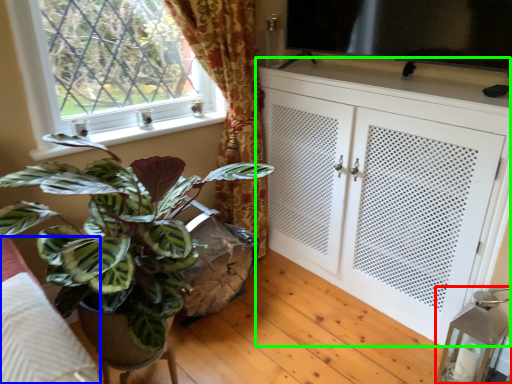
Question: Based on their relative distances, which object is farther from lamp (highlighted by a red box)? Choose from bedding (highlighted by a blue box) and cabinetry (highlighted by a green box).

Choices:
 (A) bedding
 (B) cabinetry

Answer: (A)